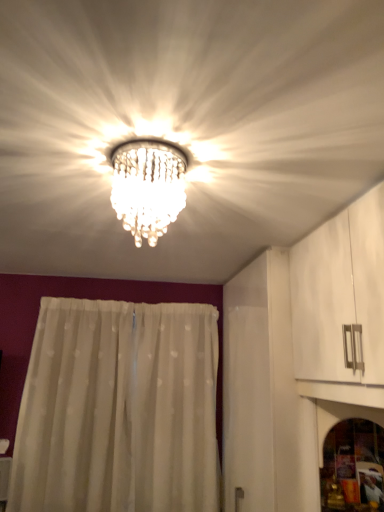
The width and height of the screenshot is (384, 512). What do you see at coordinates (118, 409) in the screenshot?
I see `white sheer curtain at center` at bounding box center [118, 409].

This screenshot has height=512, width=384. I want to click on clear crystal chandelier at center, so click(148, 186).

At what (x,y) coordinates should I click in order to perform the action: click on white sheer curtain at center. Please return your answer as a coordinate pair (x, y). Image resolution: width=384 pixels, height=512 pixels. Looking at the image, I should click on (118, 409).

How many degrees apart are the facing directions of white sheer curtain at center and clear crystal chandelier at center?

white sheer curtain at center and clear crystal chandelier at center are facing 87.1 degrees away from each other.

Does point (47, 434) appear closer or farther from the camera than point (151, 141)?

Point (47, 434) is positioned farther from the camera compared to point (151, 141).

From a real-world perspective, which object stands above the other?

clear crystal chandelier at center, from a real-world perspective.

Looking at this image, considering the relative positions of white sheer curtain at center and clear crystal chandelier at center in the image provided, is white sheer curtain at center to the left of clear crystal chandelier at center from the viewer's perspective?

Indeed, white sheer curtain at center is positioned on the left side of clear crystal chandelier at center.

How many degrees apart are the facing directions of clear crystal chandelier at center and transparent glass screen door at lower right?

The angular difference between clear crystal chandelier at center and transparent glass screen door at lower right is 0.606 degrees.

Is clear crystal chandelier at center positioned with its back to transparent glass screen door at lower right?

No, clear crystal chandelier at center's orientation is not away from transparent glass screen door at lower right.

Is clear crystal chandelier at center far from transparent glass screen door at lower right?

clear crystal chandelier at center is far away from transparent glass screen door at lower right.

From a real-world perspective, is clear crystal chandelier at center above or below transparent glass screen door at lower right?

clear crystal chandelier at center is above transparent glass screen door at lower right.

Is clear crystal chandelier at center touching white sheer curtain at center?

No, clear crystal chandelier at center is not beside white sheer curtain at center.

Does point (132, 168) come closer to viewer compared to point (56, 387)?

Yes, point (132, 168) is closer to viewer.

Could you tell me if clear crystal chandelier at center is facing white sheer curtain at center?

No, clear crystal chandelier at center is not aimed at white sheer curtain at center.

Does clear crystal chandelier at center have a greater height compared to white sheer curtain at center?

No.

Can white sheer curtain at center be found inside transparent glass screen door at lower right?

No, white sheer curtain at center is not surrounded by transparent glass screen door at lower right.

Is point (319, 467) closer or farther from the camera than point (26, 505)?

Point (319, 467).

Are transparent glass screen door at lower right and white sheer curtain at center beside each other?

No, transparent glass screen door at lower right is not beside white sheer curtain at center.

How much distance is there between transparent glass screen door at lower right and clear crystal chandelier at center?

transparent glass screen door at lower right is 1.20 meters away from clear crystal chandelier at center.

Is transparent glass screen door at lower right looking in the opposite direction of clear crystal chandelier at center?

No, transparent glass screen door at lower right's orientation is not away from clear crystal chandelier at center.

Considering the relative sizes of transparent glass screen door at lower right and clear crystal chandelier at center in the image provided, is transparent glass screen door at lower right shorter than clear crystal chandelier at center?

In fact, transparent glass screen door at lower right may be taller than clear crystal chandelier at center.

Does transparent glass screen door at lower right come in front of clear crystal chandelier at center?

No, transparent glass screen door at lower right is further to the viewer.

Considering the relative positions of white sheer curtain at center and transparent glass screen door at lower right in the image provided, is white sheer curtain at center to the left of transparent glass screen door at lower right from the viewer's perspective?

Yes.

Locate an element on the screen. The width and height of the screenshot is (384, 512). screen door above the white sheer curtain at center (from the image's perspective) is located at coordinates (340, 419).

Which of these two, white sheer curtain at center or transparent glass screen door at lower right, is bigger?

white sheer curtain at center.

Is white sheer curtain at center oriented towards transparent glass screen door at lower right?

Yes, white sheer curtain at center is facing transparent glass screen door at lower right.

Find the location of `curtain lying behind the clear crystal chandelier at center`. curtain lying behind the clear crystal chandelier at center is located at coordinates (118, 409).

You are a GUI agent. You are given a task and a screenshot of the screen. Output one action in this format:
    pyautogui.click(x=<x>, y=<y>)
    Task: Click on the screen door directly beneath the clear crystal chandelier at center (from a real-world perspective)
    
    Given the screenshot: What is the action you would take?
    pyautogui.click(x=340, y=419)

Which object lies nearer to the anchor point white sheer curtain at center, transparent glass screen door at lower right or clear crystal chandelier at center?

transparent glass screen door at lower right.

From the image, which object appears to be farther from clear crystal chandelier at center, transparent glass screen door at lower right or white sheer curtain at center?

white sheer curtain at center lies further to clear crystal chandelier at center than the other object.

When comparing their distances from white sheer curtain at center, does clear crystal chandelier at center or transparent glass screen door at lower right seem further?

The object further to white sheer curtain at center is clear crystal chandelier at center.

Considering their positions, is white sheer curtain at center positioned further to transparent glass screen door at lower right than clear crystal chandelier at center?

Among the two, white sheer curtain at center is located further to transparent glass screen door at lower right.

When comparing their distances from transparent glass screen door at lower right, does clear crystal chandelier at center or white sheer curtain at center seem further?

white sheer curtain at center is further to transparent glass screen door at lower right.

Which object lies further to the anchor point clear crystal chandelier at center, white sheer curtain at center or transparent glass screen door at lower right?

white sheer curtain at center lies further to clear crystal chandelier at center than the other object.

Identify the location of screen door positioned between clear crystal chandelier at center and white sheer curtain at center from near to far. (340, 419).